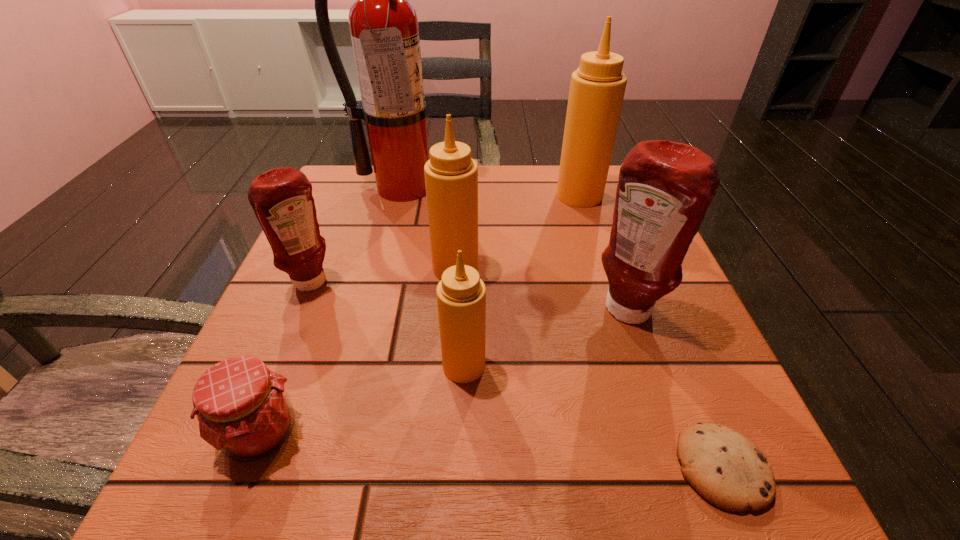
Locate an element on the screen. The height and width of the screenshot is (540, 960). free space that satisfies the following two spatial constraints: 1. on the nozzle side of the third nearest object; 2. on the right side of the red fire extinguisher is located at coordinates (358, 366).

Where is `free region that satisfies the following two spatial constraints: 1. on the nozzle side of the right red condiment; 2. on the left side of the tallest object`? free region that satisfies the following two spatial constraints: 1. on the nozzle side of the right red condiment; 2. on the left side of the tallest object is located at coordinates (372, 313).

The image size is (960, 540). Identify the location of vacant area that satisfies the following two spatial constraints: 1. on the back side of the farthest tan condiment; 2. on the left side of the jam. (355, 195).

Locate an element on the screen. The height and width of the screenshot is (540, 960). vacant position in the image that satisfies the following two spatial constraints: 1. on the back side of the bigger red condiment; 2. on the right side of the third nearest object is located at coordinates (466, 313).